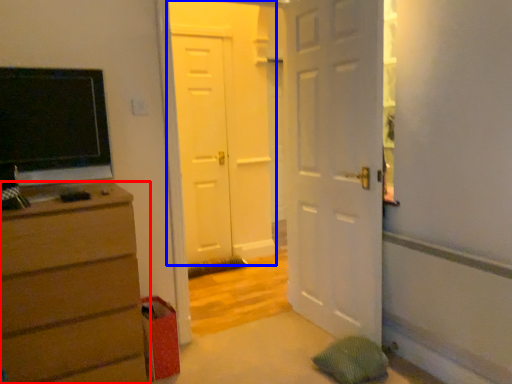
Question: Which point is closer to the camera, chest of drawers (highlighted by a red box) or door (highlighted by a blue box)?

Choices:
 (A) chest of drawers
 (B) door

Answer: (A)